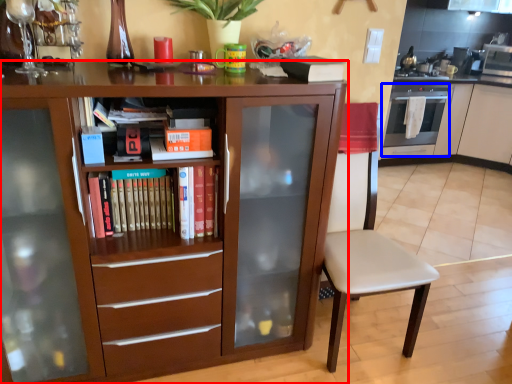
Question: Which object is closer to the camera taking this photo, cabinetry (highlighted by a red box) or oven (highlighted by a blue box)?

Choices:
 (A) cabinetry
 (B) oven

Answer: (A)